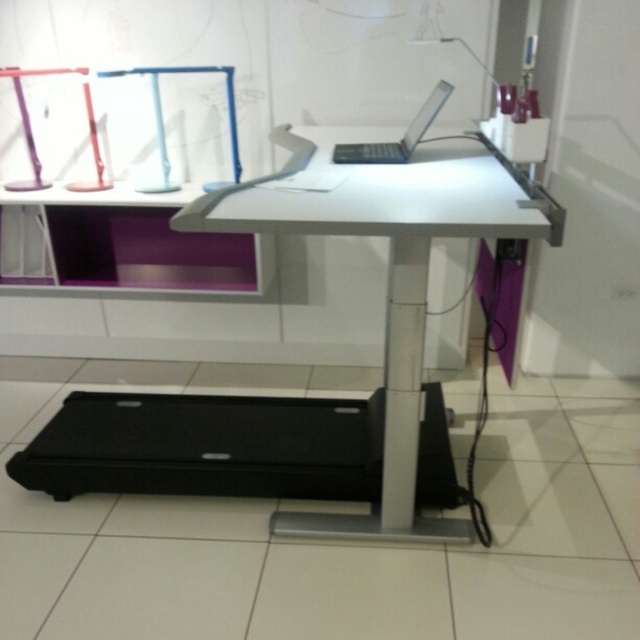
Between point (408, 236) and point (380, 161), which one is positioned in front?

Point (408, 236) is more forward.

Between white glossy computer desk at center and satin silver laptop at upper center, which one has more height?

white glossy computer desk at center is taller.

Is point (195, 221) closer to viewer compared to point (378, 161)?

Yes, it is in front of point (378, 161).

The height and width of the screenshot is (640, 640). In order to click on white glossy computer desk at center in this screenshot , I will do `click(387, 276)`.